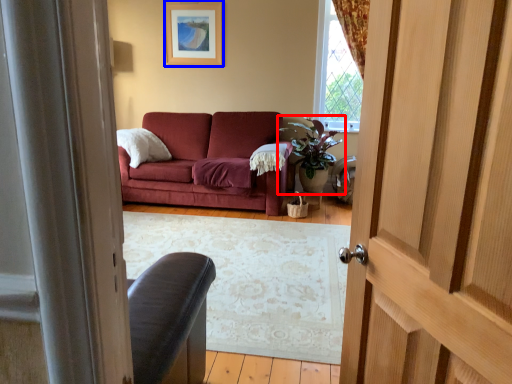
Question: Which point is closer to the camera, houseplant (highlighted by a red box) or picture frame (highlighted by a blue box)?

Choices:
 (A) houseplant
 (B) picture frame

Answer: (A)